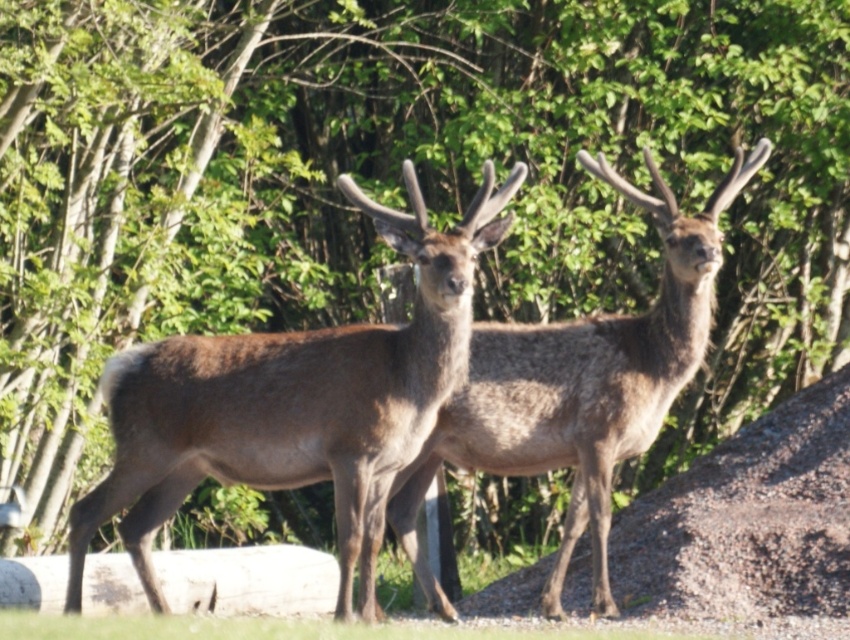
Question: Among these points, which one is nearest to the camera?

Choices:
 (A) (344, 561)
 (B) (561, 566)

Answer: (A)

Question: Does brown matte deer at center lie in front of brown fuzzy deer at center?

Choices:
 (A) no
 (B) yes

Answer: (B)

Question: Does brown matte deer at center have a smaller size compared to brown fuzzy deer at center?

Choices:
 (A) no
 (B) yes

Answer: (B)

Question: Can you confirm if brown matte deer at center is positioned to the right of brown fuzzy deer at center?

Choices:
 (A) yes
 (B) no

Answer: (B)

Question: Which of the following is the closest to the observer?

Choices:
 (A) (636, 420)
 (B) (258, 337)

Answer: (B)